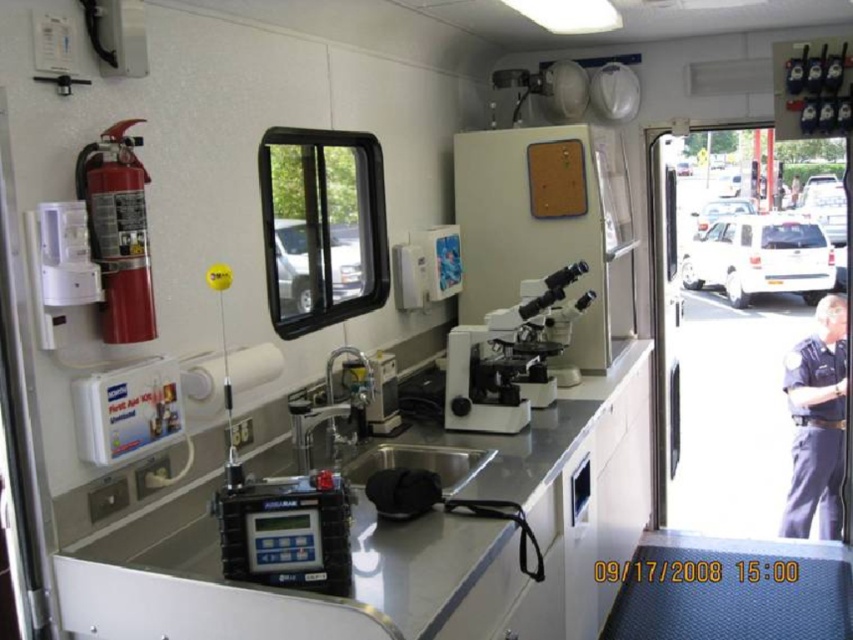
You are a technician needing to place a rectangular box that is 1 meter wide onto the available space between the white plastic microscope at center and the white plastic window at upper center. Based on the scene, can you determine if the box will fit horizontally between these two objects?

The white plastic microscope at center might be wider than white plastic window at upper center, so the distance between them is uncertain. Without knowing the exact width of the microscope and the window, it is impossible to determine if the 1 meter wide box will fit horizontally between them.

You are a technician in this mobile lab and need to place the white plastic microscope at center and the white matte truck at right onto a shelf that can only hold items narrower than 30 cm. Based on their widths, can both items fit on the shelf?

The white plastic microscope at center has a lesser width compared to white matte truck at right. Since the shelf requires items narrower than 30 cm, we need to know the exact width of the truck. If the truck is under 30 cm, both can fit. However, without specific measurements, we can only confirm the microscope is narrower than the truck.

You are a scientist working in this mobile lab and need to adjust the settings on the white plastic microscope at center. To do this, you must first move the white plastic window at upper center out of the way. Is this necessary?

The white plastic microscope at center is below the white plastic window at upper center, so you do not need to move the window to adjust the microscope.